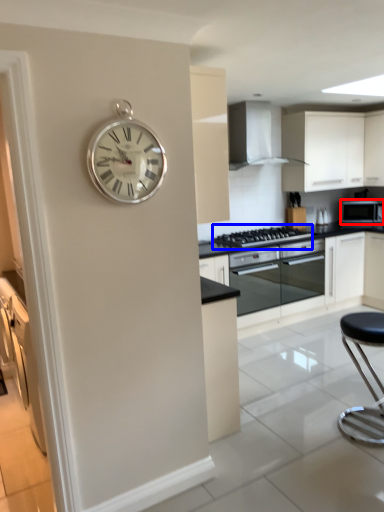
Question: Which object is closer to the camera taking this photo, microwave oven (highlighted by a red box) or gas stove (highlighted by a blue box)?

Choices:
 (A) microwave oven
 (B) gas stove

Answer: (B)